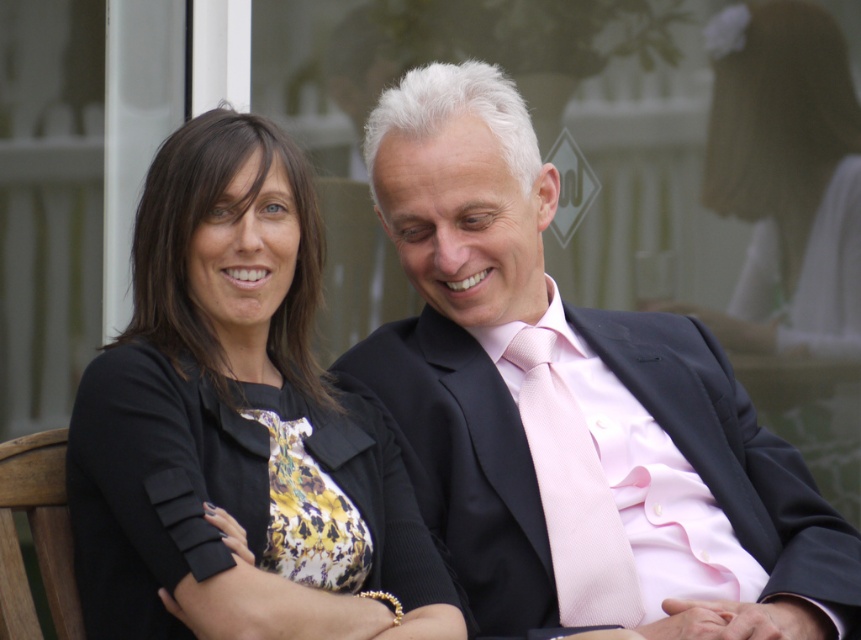
Question: Which point appears closest to the camera in this image?

Choices:
 (A) (553, 536)
 (B) (121, 344)
 (C) (544, 358)

Answer: (B)

Question: Based on their relative distances, which object is farther from the matte black blazer at center?

Choices:
 (A) pink silk tie at center
 (B) black matte dress at left

Answer: (B)

Question: Does matte black suit at center have a greater width compared to black matte dress at left?

Choices:
 (A) no
 (B) yes

Answer: (B)

Question: Among these objects, which one is nearest to the camera?

Choices:
 (A) matte black suit at center
 (B) matte black blazer at center
 (C) black matte dress at left

Answer: (C)

Question: Can you confirm if black matte dress at left is positioned to the right of pink silk tie at center?

Choices:
 (A) no
 (B) yes

Answer: (A)

Question: Is matte black suit at center to the right of matte black blazer at center from the viewer's perspective?

Choices:
 (A) no
 (B) yes

Answer: (A)